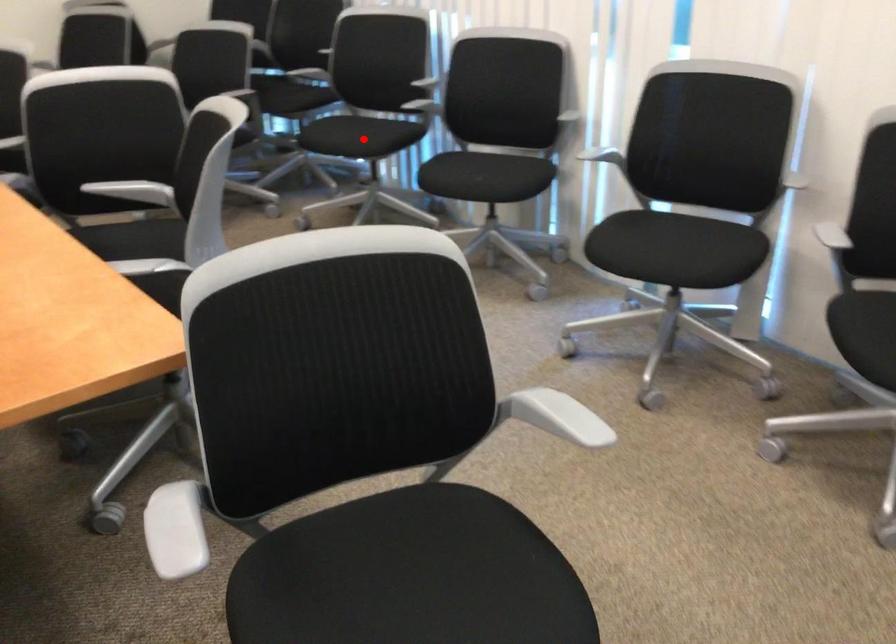
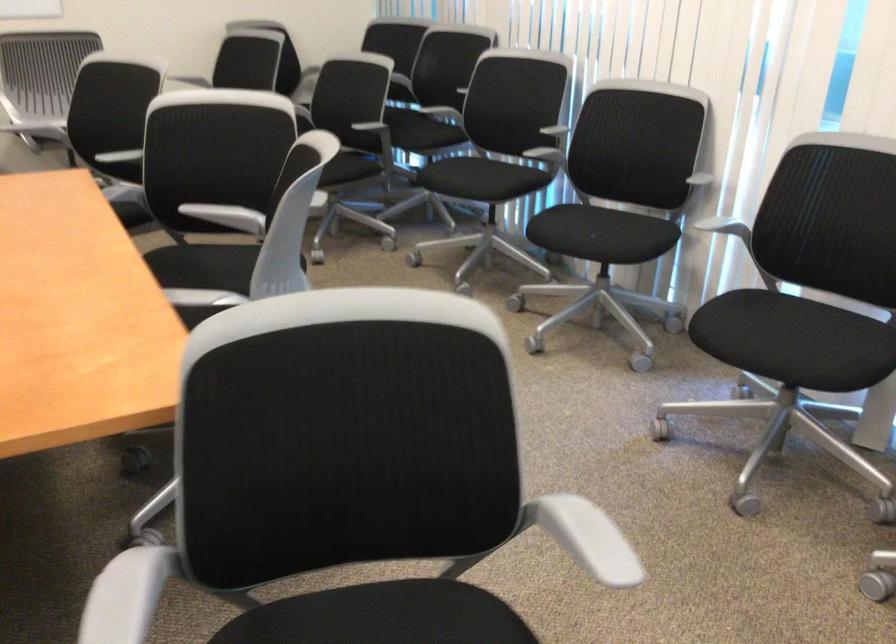
Where in the second image is the point corresponding to the highlighted location from the first image?

(480, 178)